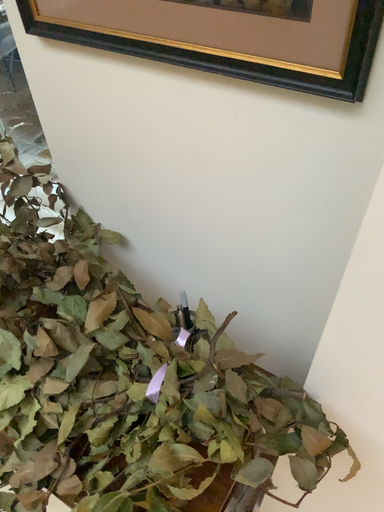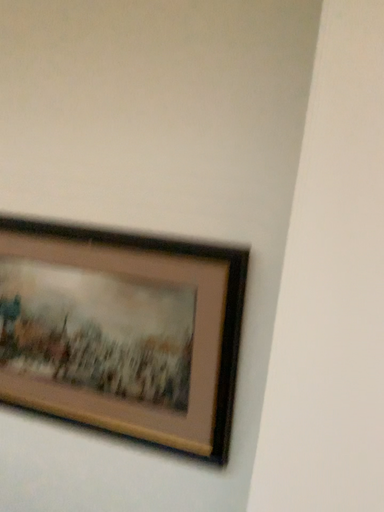
Question: How did the camera likely rotate when shooting the video?

Choices:
 (A) rotated upward
 (B) rotated downward

Answer: (A)